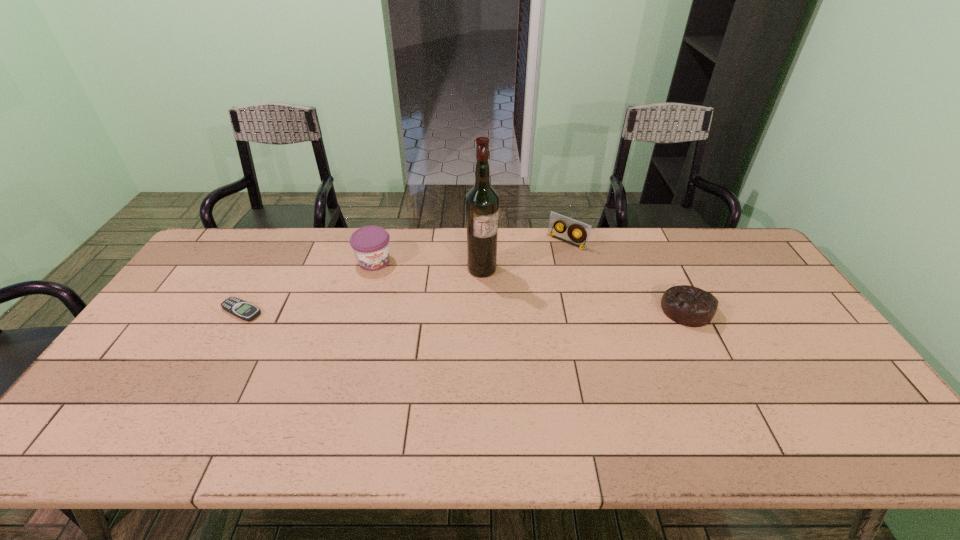
The height and width of the screenshot is (540, 960). Identify the location of the shortest object. point(246,311).

At what (x,y) coordinates should I click in order to perform the action: click on the leftmost object. Please return your answer as a coordinate pair (x, y). The width and height of the screenshot is (960, 540). Looking at the image, I should click on (246, 311).

Find the location of a particular element. The width and height of the screenshot is (960, 540). beanbag is located at coordinates coord(693,307).

Where is `the rightmost object`? This screenshot has width=960, height=540. the rightmost object is located at coordinates pyautogui.click(x=693, y=307).

The width and height of the screenshot is (960, 540). In order to click on wine bottle in this screenshot , I will do `click(482, 202)`.

Where is `the third object from right to left`? the third object from right to left is located at coordinates (482, 202).

The width and height of the screenshot is (960, 540). In order to click on the fourth object from left to right in this screenshot , I will do `click(556, 220)`.

Find the location of a particular element. The height and width of the screenshot is (540, 960). jam is located at coordinates 370,244.

Identify the location of vacant point located 0.270m on the front of the beeper. (188, 406).

Where is `vacant space located 0.070m on the back of the fourth tallest object`? This screenshot has width=960, height=540. vacant space located 0.070m on the back of the fourth tallest object is located at coordinates (670, 277).